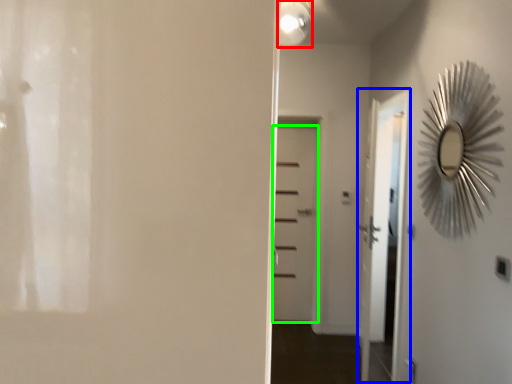
Question: Estimate the real-world distances between objects in this image. Which object is farther from light fixture (highlighted by a red box), screen door (highlighted by a blue box) or door (highlighted by a green box)?

Choices:
 (A) screen door
 (B) door

Answer: (A)